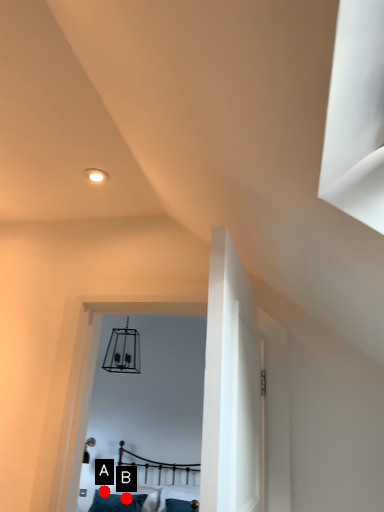
Question: Two points are circled on the image, labeled by A and B beside each circle. Which of the following is the closest to the observer?

Choices:
 (A) A is closer
 (B) B is closer

Answer: (B)